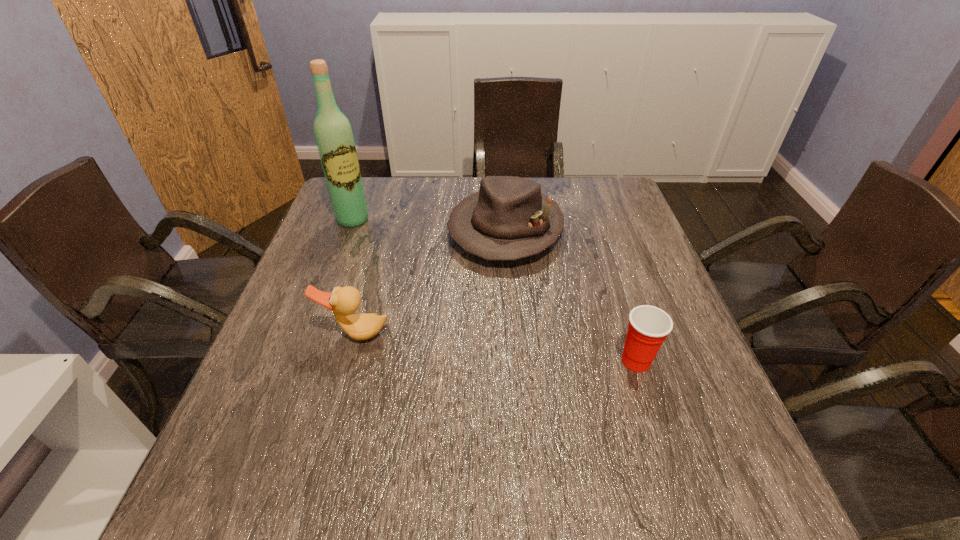
Find the location of a particular element. The image size is (960, 540). vacant spot on the desktop that is between the third farthest object and the rightmost object and is positioned on the decorative side of the hat is located at coordinates (454, 343).

Where is `free space on the desktop that is between the duck and the rightmost object and is positioned on the front-facing side of the wine bottle`? Image resolution: width=960 pixels, height=540 pixels. free space on the desktop that is between the duck and the rightmost object and is positioned on the front-facing side of the wine bottle is located at coordinates (458, 344).